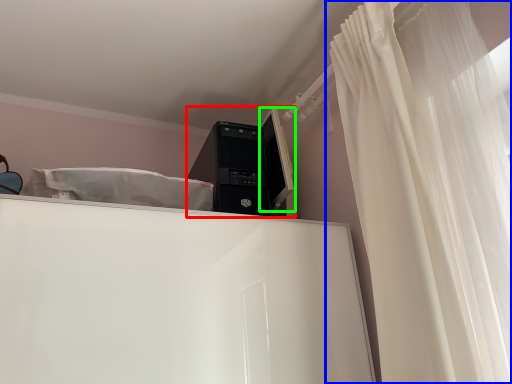
Question: Which object is the farthest from desktop computer (highlighted by a red box)? Choose among these: curtain (highlighted by a blue box) or computer monitor (highlighted by a green box).

Choices:
 (A) curtain
 (B) computer monitor

Answer: (A)